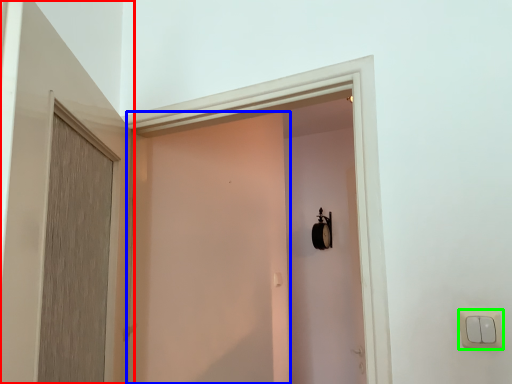
Question: Considering the real-world distances, which object is closest to door (highlighted by a red box)? screen door (highlighted by a blue box) or light switch (highlighted by a green box).

Choices:
 (A) screen door
 (B) light switch

Answer: (A)